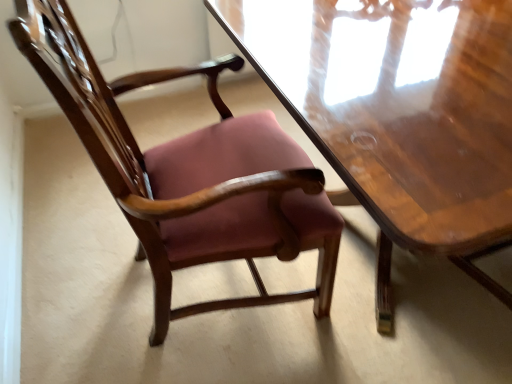
Question: Should I look upward or downward to see matte wood chair at center?

Choices:
 (A) up
 (B) down

Answer: (A)